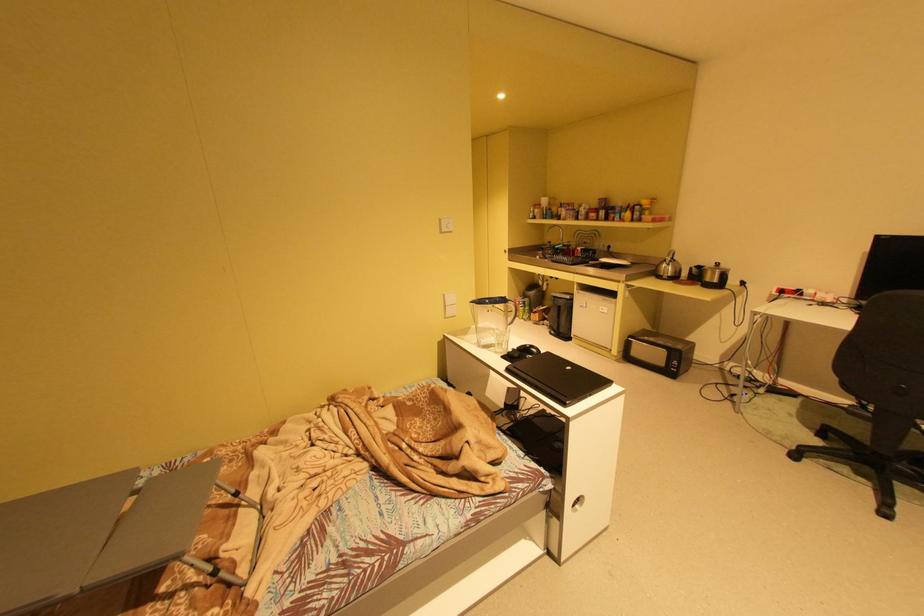
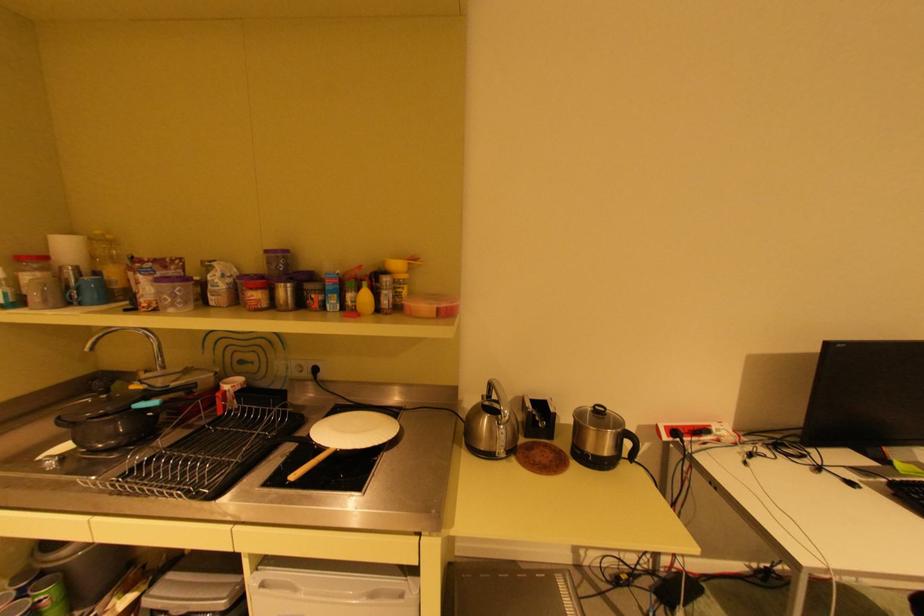
Locate, in the second image, the point that corresponds to point 723,262 in the first image.

(602, 407)